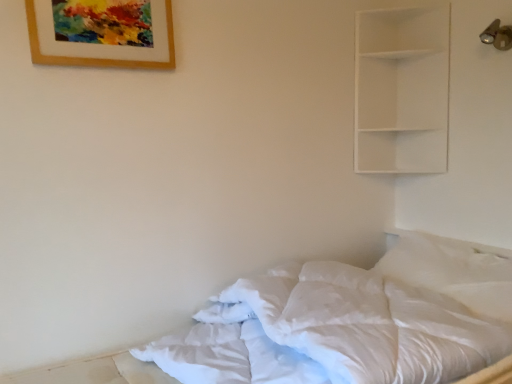
Question: Considering the relative positions of wooden picture frame at upper left and white matte shelf at upper right in the image provided, is wooden picture frame at upper left to the left of white matte shelf at upper right from the viewer's perspective?

Choices:
 (A) no
 (B) yes

Answer: (B)

Question: Can you confirm if wooden picture frame at upper left is shorter than white matte shelf at upper right?

Choices:
 (A) no
 (B) yes

Answer: (B)

Question: Can you confirm if wooden picture frame at upper left is bigger than white matte shelf at upper right?

Choices:
 (A) yes
 (B) no

Answer: (B)

Question: Can you confirm if wooden picture frame at upper left is taller than white matte shelf at upper right?

Choices:
 (A) no
 (B) yes

Answer: (A)

Question: Is wooden picture frame at upper left facing away from white matte shelf at upper right?

Choices:
 (A) no
 (B) yes

Answer: (A)

Question: From a real-world perspective, is white soft bed at lower right physically located above or below wooden picture frame at upper left?

Choices:
 (A) above
 (B) below

Answer: (B)

Question: Visually, is white soft bed at lower right positioned to the left or to the right of wooden picture frame at upper left?

Choices:
 (A) right
 (B) left

Answer: (A)

Question: Is point pyautogui.click(x=24, y=370) positioned closer to the camera than point pyautogui.click(x=159, y=34)?

Choices:
 (A) farther
 (B) closer

Answer: (B)

Question: From their relative heights in the image, would you say white soft bed at lower right is taller or shorter than wooden picture frame at upper left?

Choices:
 (A) short
 (B) tall

Answer: (B)

Question: From the image's perspective, is white matte shelf at upper right positioned above or below wooden picture frame at upper left?

Choices:
 (A) below
 (B) above

Answer: (A)

Question: Based on their sizes in the image, would you say white matte shelf at upper right is bigger or smaller than wooden picture frame at upper left?

Choices:
 (A) small
 (B) big

Answer: (B)

Question: Considering the positions of white matte shelf at upper right and wooden picture frame at upper left in the image, is white matte shelf at upper right wider or thinner than wooden picture frame at upper left?

Choices:
 (A) thin
 (B) wide

Answer: (B)

Question: In terms of height, does white matte shelf at upper right look taller or shorter compared to wooden picture frame at upper left?

Choices:
 (A) short
 (B) tall

Answer: (B)

Question: Is white matte shelf at upper right in front of or behind white soft bed at lower right in the image?

Choices:
 (A) front
 (B) behind

Answer: (B)

Question: From the image's perspective, is white matte shelf at upper right positioned above or below white soft bed at lower right?

Choices:
 (A) above
 (B) below

Answer: (A)